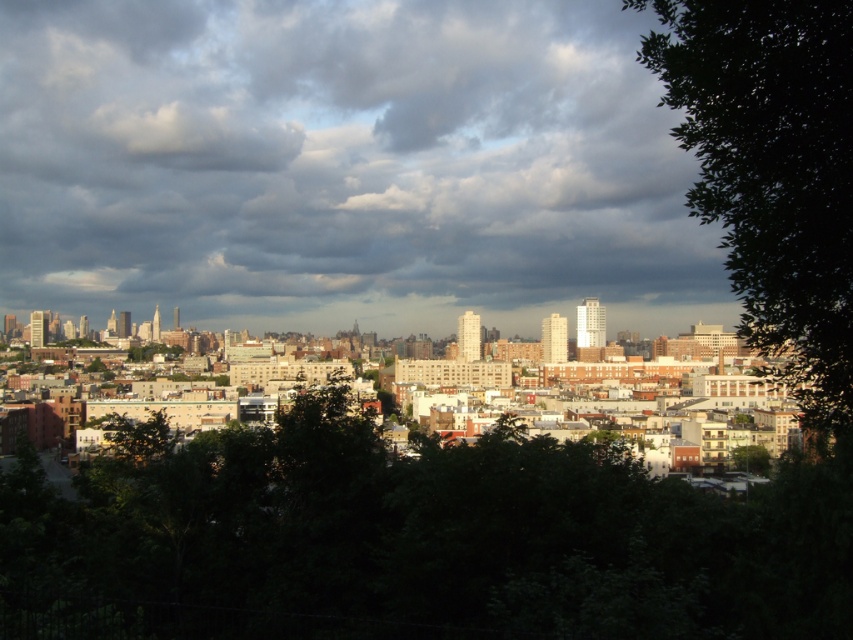
You are standing at the viewpoint and want to take a photo that includes both the cloudy sky at upper center and the green leafy tree at right. Since you want the sky to appear closer in the photo, which object should you focus on when adjusting your camera settings?

To make the cloudy sky at upper center appear closer in the photo, focus on the cloudy sky at upper center because it is further to the viewer than the green leafy tree at right, so adjusting focus on it will bring it closer in the composition.

You are standing on a hill overlooking the city and see two green leafy trees. One is labeled as the green leafy tree at center and the other as the green leafy tree at right. From your vantage point, which tree is positioned more to the left?

The green leafy tree at center is positioned more to the left compared to the green leafy tree at right.